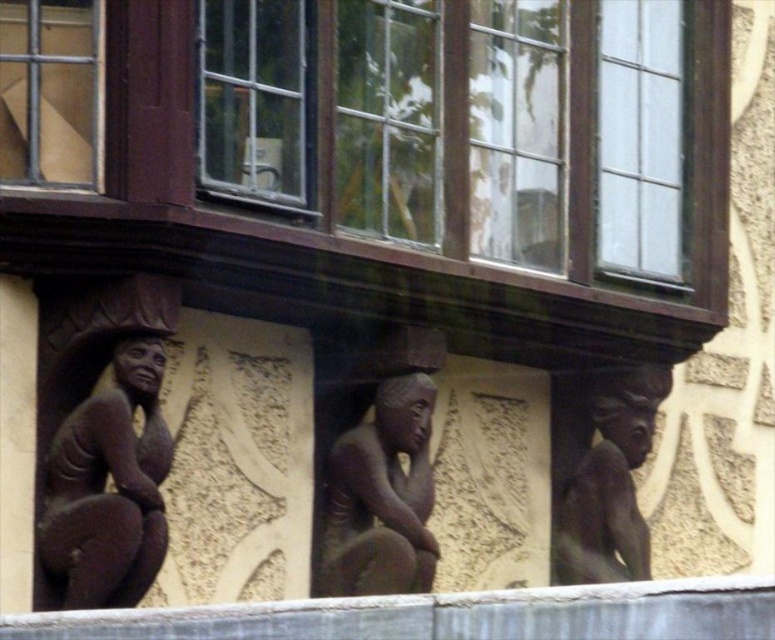
Question: Is brown stone figure at left below matte glass window at upper left?

Choices:
 (A) no
 (B) yes

Answer: (B)

Question: Where is brown stone figure at center located in relation to brown stone figure at right in the image?

Choices:
 (A) above
 (B) below

Answer: (B)

Question: Which object is positioned closest to the brown stone window at center?

Choices:
 (A) brown stone figure at left
 (B) clear glass window at upper center
 (C) brown stone figure at center
 (D) brown stone figure at right

Answer: (B)

Question: Is brown stone figure at left thinner than matte glass window at upper left?

Choices:
 (A) yes
 (B) no

Answer: (A)

Question: Which point is closer to the camera taking this photo?

Choices:
 (A) (93, 513)
 (B) (360, 502)
 (C) (23, 22)
 (D) (584, 465)

Answer: (A)

Question: Which of the following is the farthest from the observer?

Choices:
 (A) brown stone figure at center
 (B) brown stone window at center
 (C) brown stone figure at left
 (D) matte glass window at upper left

Answer: (A)